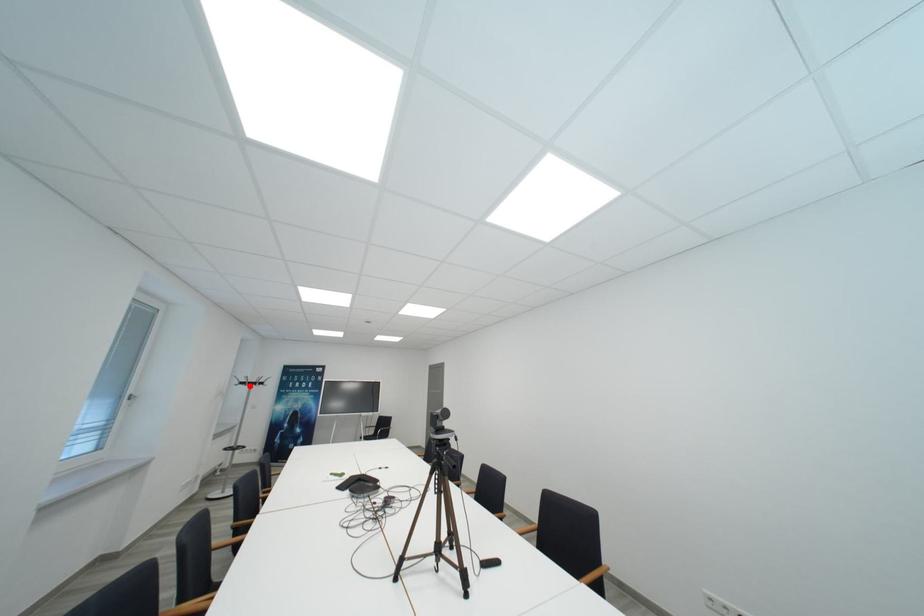
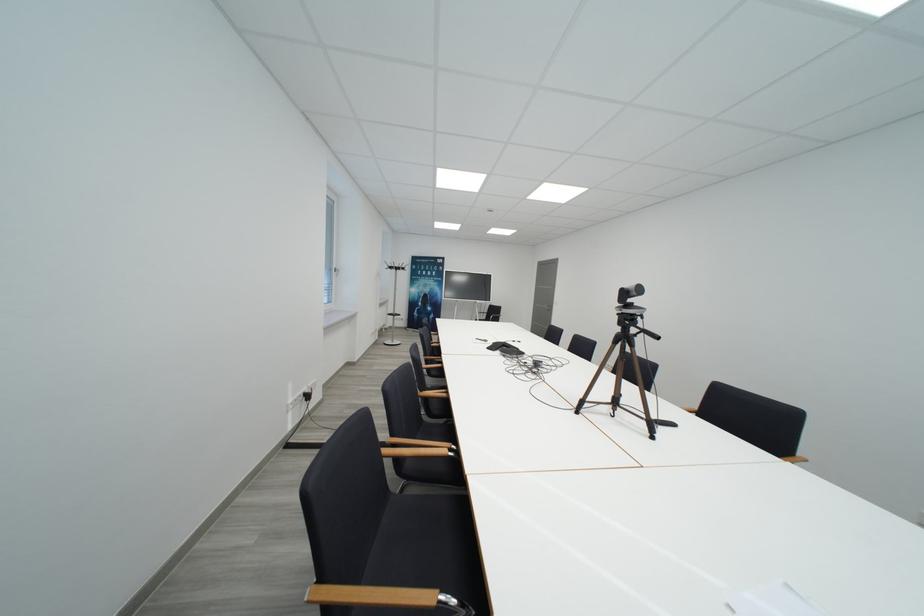
In the second image, find the point that corresponds to the highlighted location in the first image.

(397, 270)